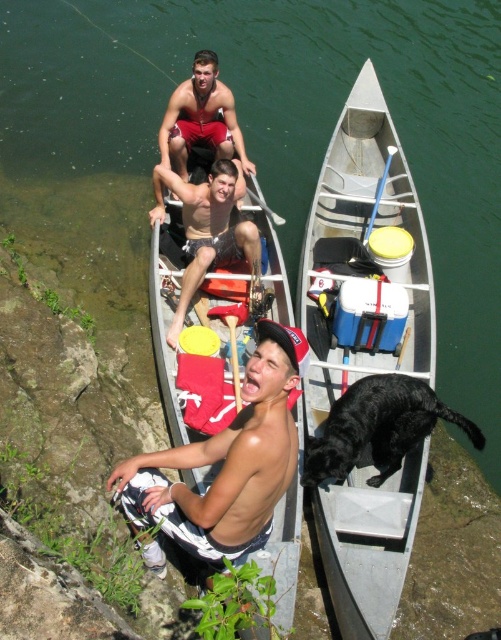
Looking at this image, you are in a canoe and need to choose between the yellow foam paddle at center and the wooden paddle at center. Which paddle is closer to the center of the canoe?

The yellow foam paddle at center is closer to the center of the canoe because it is positioned to the right of the wooden paddle at center, meaning it is nearer to the central point.

You are a photographer trying to capture a photo of the white plastic boat at center and the matte red canoe at center from above. Which one will appear lower in the photo?

The white plastic boat at center appears lower in the photo because it is positioned below the matte red canoe at center.

You are navigating a drone over the lake and need to drop a life jacket to the person wearing the matte black shorts at center. According to the coordinates provided, where should you aim the drone to ensure the life jacket lands near them?

The matte black shorts at center is located at point (207, 228), so you should aim the drone at those coordinates to drop the life jacket near them.